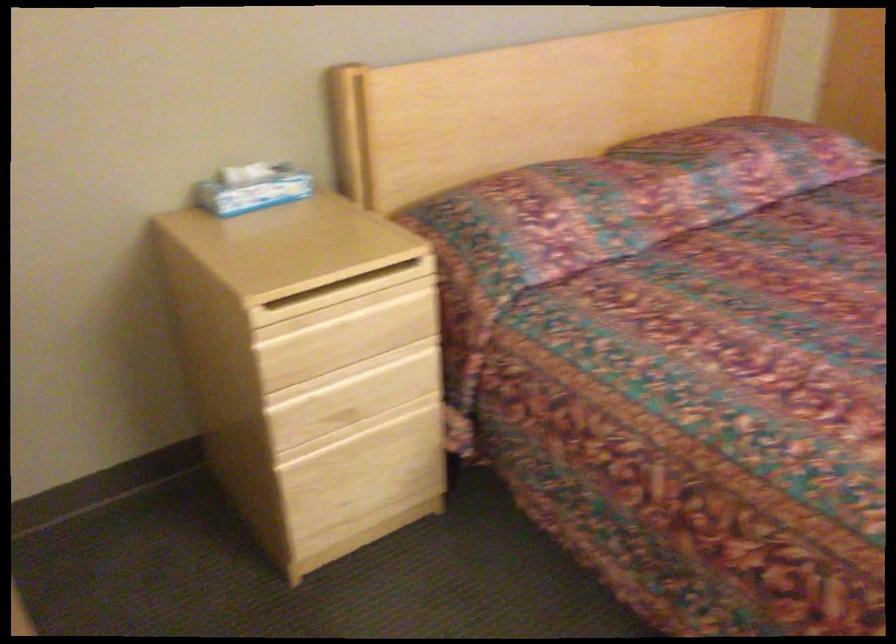
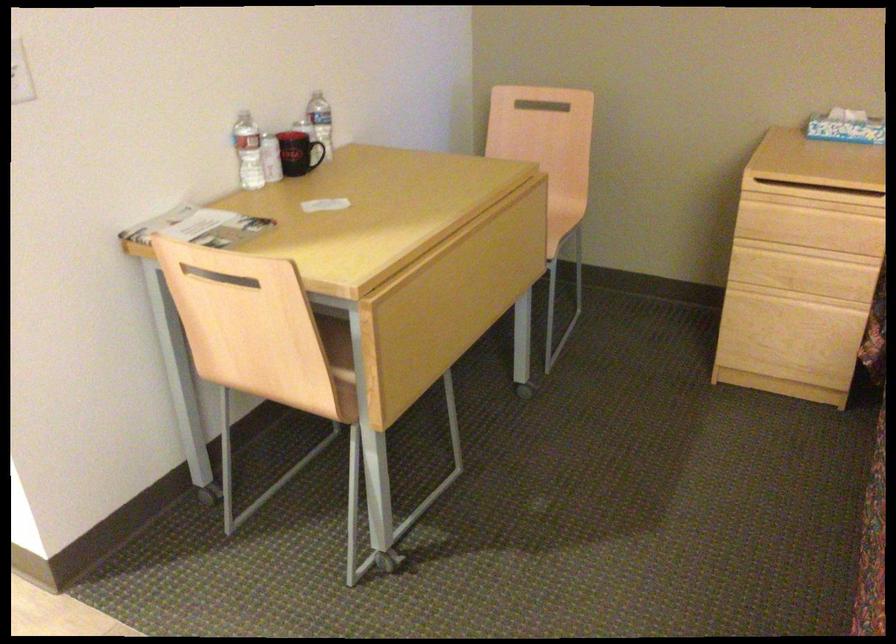
Where in the second image is the point corresponding to point 359,366 from the first image?

(810, 251)